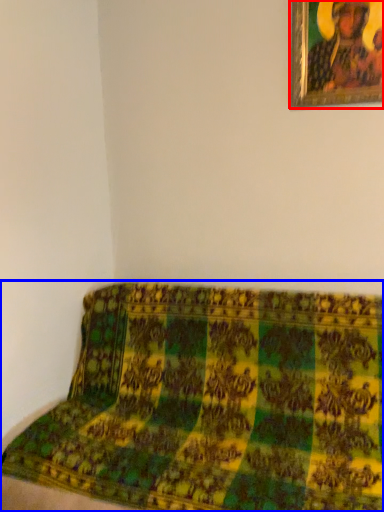
Question: Among these objects, which one is farthest to the camera, picture frame (highlighted by a red box) or furniture (highlighted by a blue box)?

Choices:
 (A) picture frame
 (B) furniture

Answer: (A)